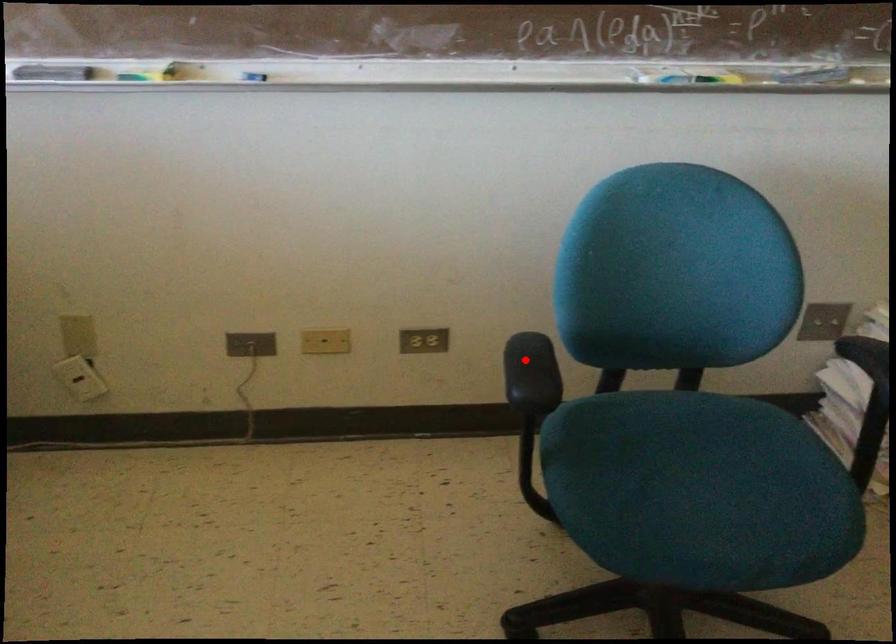
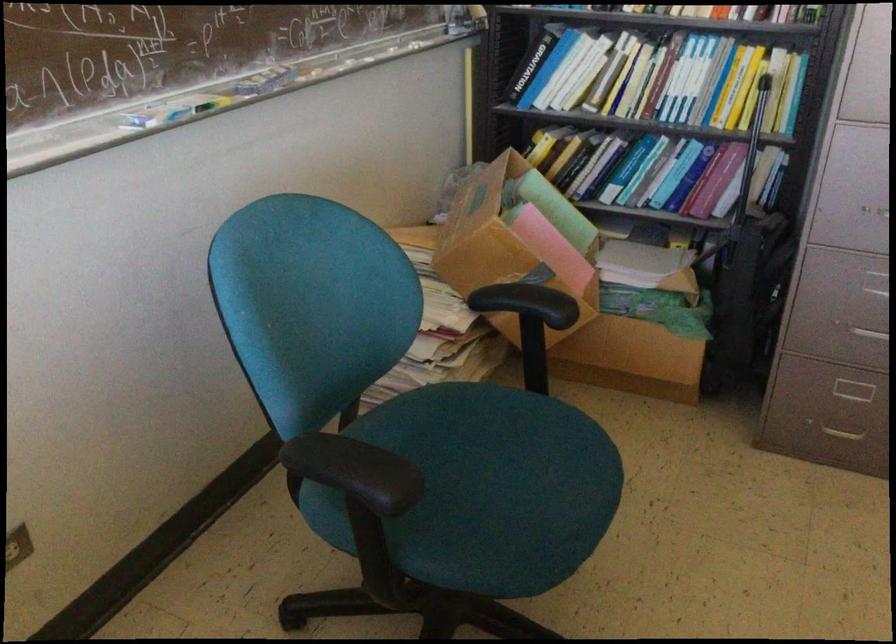
Question: I am providing you with two images of the same scene from different viewpoints. Image1 has a red point marked. In image2, the corresponding 3D location appears at what relative position? Reply with the corresponding letter.

Choices:
 (A) Closer
 (B) Farther

Answer: (A)